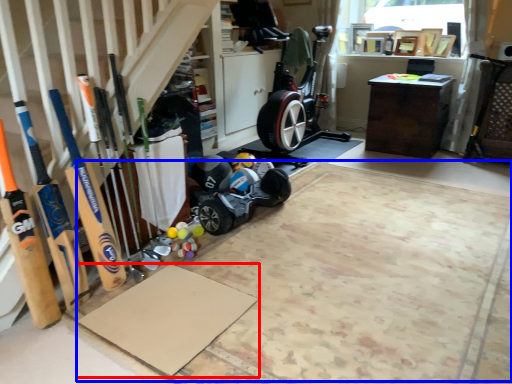
Question: Among these objects, which one is farthest to the camera, yoga mat (highlighted by a red box) or yoga mat (highlighted by a blue box)?

Choices:
 (A) yoga mat
 (B) yoga mat

Answer: (A)